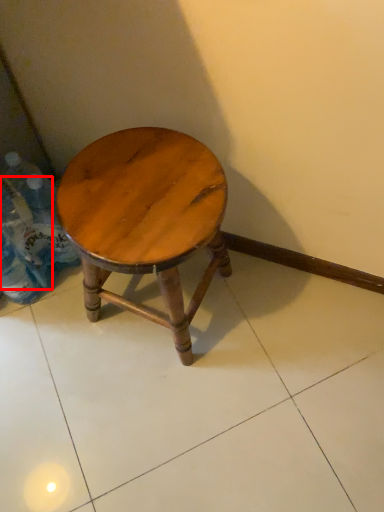
Question: From the image's perspective, what is the correct spatial positioning of bottle (annotated by the red box) in reference to stool?

Choices:
 (A) below
 (B) above

Answer: (B)